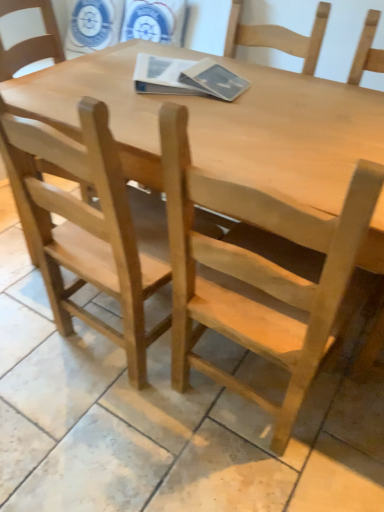
What is the approximate width of natural wood table at center?

natural wood table at center is 35.59 inches in width.

In order to click on natural wood chair at center, the second chair from the left in this screenshot , I will do 260,274.

Can you confirm if natural wood chair at center, placed as the first chair when sorted from right to left, is taller than natural wood chair at left, the 2th chair viewed from the right?

No, natural wood chair at center, placed as the first chair when sorted from right to left, is not taller than natural wood chair at left, the 2th chair viewed from the right.

From the image's perspective, which object appears higher, natural wood chair at center, placed as the first chair when sorted from right to left, or natural wood chair at left, the 1th chair in the left-to-right sequence?

natural wood chair at left, the 1th chair in the left-to-right sequence.

I want to click on chair on the left of natural wood chair at center, the second chair from the left, so click(85, 228).

From the image's perspective, is natural wood chair at left, the 1th chair in the left-to-right sequence, below natural wood chair at center, the second chair from the left?

Incorrect, from the image's perspective, natural wood chair at left, the 1th chair in the left-to-right sequence, is higher than natural wood chair at center, the second chair from the left.

Does natural wood chair at left, the 2th chair viewed from the right, appear on the left side of natural wood chair at center, the second chair from the left?

Yes.

Can you confirm if natural wood chair at left, the 2th chair viewed from the right, is shorter than natural wood chair at center, placed as the first chair when sorted from right to left?

Answer: No, natural wood chair at left, the 2th chair viewed from the right, is not shorter than natural wood chair at center, placed as the first chair when sorted from right to left.

How far apart are natural wood chair at left, the 1th chair in the left-to-right sequence, and natural wood chair at center, the second chair from the left?

The distance of natural wood chair at left, the 1th chair in the left-to-right sequence, from natural wood chair at center, the second chair from the left, is 31.02 centimeters.

Is natural wood chair at center, the second chair from the left, with natural wood table at center?

No, natural wood chair at center, the second chair from the left, is not in contact with natural wood table at center.

Can you confirm if natural wood chair at center, the second chair from the left, is shorter than natural wood table at center?

No, natural wood chair at center, the second chair from the left, is not shorter than natural wood table at center.

Considering the positions of point (200, 250) and point (316, 134), is point (200, 250) closer or farther from the camera than point (316, 134)?

Point (200, 250) is closer to the camera than point (316, 134).

From the image's perspective, which object appears higher, natural wood chair at center, the second chair from the left, or natural wood table at center?

natural wood table at center, from the image's perspective.

From a real-world perspective, who is located higher, natural wood table at center or natural wood chair at left, the 1th chair in the left-to-right sequence?

From a 3D spatial view, natural wood chair at left, the 1th chair in the left-to-right sequence, is above.

Is natural wood chair at left, the 2th chair viewed from the right, completely or partially inside natural wood table at center?

Yes.

Does natural wood table at center come behind natural wood chair at left, the 2th chair viewed from the right?

Yes, natural wood table at center is further from the camera.

How different are the orientations of natural wood table at center and natural wood chair at left, the 2th chair viewed from the right, in degrees?

They differ by 175 degrees in their facing directions.

Based on the photo, measure the distance between natural wood chair at left, the 2th chair viewed from the right, and natural wood table at center.

A: A distance of 17.23 inches exists between natural wood chair at left, the 2th chair viewed from the right, and natural wood table at center.

Locate an element on the screen. table located underneath the natural wood chair at left, the 1th chair in the left-to-right sequence (from a real-world perspective) is located at coordinates (221, 123).

Is natural wood chair at left, the 1th chair in the left-to-right sequence, facing towards natural wood table at center?

Yes, natural wood chair at left, the 1th chair in the left-to-right sequence, is aimed at natural wood table at center.

Is natural wood chair at left, the 1th chair in the left-to-right sequence, positioned beyond the bounds of natural wood table at center?

Actually, natural wood chair at left, the 1th chair in the left-to-right sequence, is at least partially inside natural wood table at center.

Which is in front, point (121, 157) or point (226, 256)?

The point (226, 256) is more forward.

Would you say natural wood table at center is outside natural wood chair at center, placed as the first chair when sorted from right to left?

Indeed, natural wood table at center is completely outside natural wood chair at center, placed as the first chair when sorted from right to left.

From a real-world perspective, which is physically above, natural wood table at center or natural wood chair at center, placed as the first chair when sorted from right to left?

natural wood chair at center, placed as the first chair when sorted from right to left, is physically above.

You are a GUI agent. You are given a task and a screenshot of the screen. Output one action in this format:
    pyautogui.click(x=<x>, y=<y>)
    Task: Click on the table behind the natural wood chair at center, the second chair from the left
    
    Given the screenshot: What is the action you would take?
    pyautogui.click(x=221, y=123)

Find the location of a particular element. chair in front of the natural wood chair at left, the 2th chair viewed from the right is located at coordinates [x=260, y=274].

I want to click on chair that appears above the natural wood chair at left, the 1th chair in the left-to-right sequence (from a real-world perspective), so click(260, 274).

When comparing their distances from natural wood chair at center, placed as the first chair when sorted from right to left, does natural wood chair at left, the 1th chair in the left-to-right sequence, or natural wood table at center seem closer?

Based on the image, natural wood chair at left, the 1th chair in the left-to-right sequence, appears to be nearer to natural wood chair at center, placed as the first chair when sorted from right to left.

From the image, which object appears to be nearer to natural wood chair at left, the 2th chair viewed from the right, natural wood table at center or natural wood chair at center, placed as the first chair when sorted from right to left?

The object closer to natural wood chair at left, the 2th chair viewed from the right, is natural wood chair at center, placed as the first chair when sorted from right to left.

Based on their spatial positions, is natural wood chair at left, the 1th chair in the left-to-right sequence, or natural wood chair at center, the second chair from the left, further from natural wood table at center?

natural wood chair at left, the 1th chair in the left-to-right sequence, is positioned further to the anchor natural wood table at center.

When comparing their distances from natural wood table at center, does natural wood chair at center, the second chair from the left, or natural wood chair at left, the 2th chair viewed from the right, seem further?

The object further to natural wood table at center is natural wood chair at left, the 2th chair viewed from the right.

Looking at the image, which one is located further to natural wood chair at left, the 1th chair in the left-to-right sequence, natural wood chair at center, placed as the first chair when sorted from right to left, or natural wood table at center?

The object further to natural wood chair at left, the 1th chair in the left-to-right sequence, is natural wood table at center.

Based on their spatial positions, is natural wood table at center or natural wood chair at left, the 1th chair in the left-to-right sequence, closer to natural wood chair at center, the second chair from the left?

Based on the image, natural wood chair at left, the 1th chair in the left-to-right sequence, appears to be nearer to natural wood chair at center, the second chair from the left.

Locate an element on the screen. Image resolution: width=384 pixels, height=512 pixels. table between natural wood chair at left, the 1th chair in the left-to-right sequence, and natural wood chair at center, placed as the first chair when sorted from right to left is located at coordinates (221, 123).